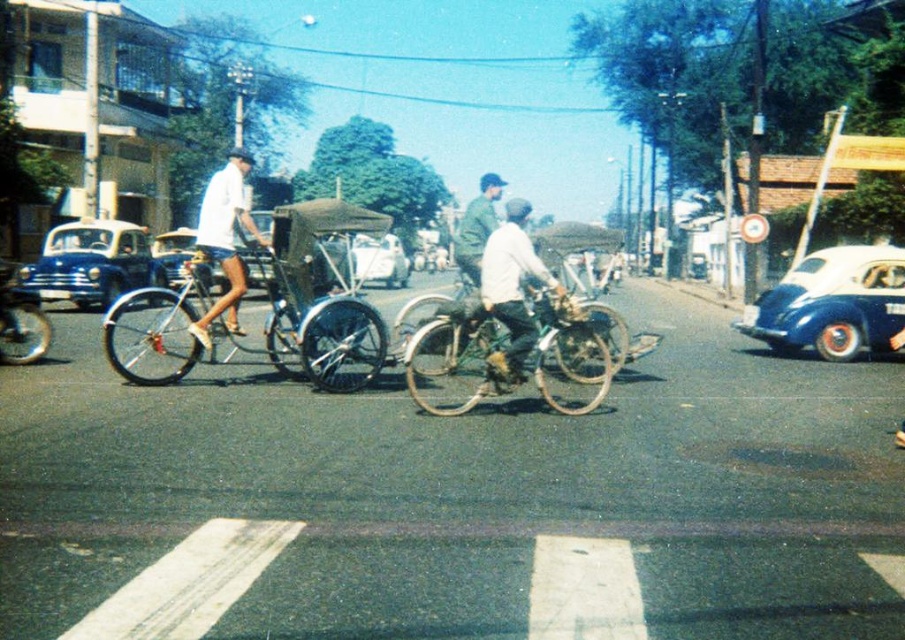
The width and height of the screenshot is (905, 640). Describe the element at coordinates (832, 304) in the screenshot. I see `blue matte car at right` at that location.

Between point (808, 333) and point (510, 326), which one is positioned behind?

The point (808, 333) is more distant.

Identify the location of blue matte car at right. (832, 304).

The image size is (905, 640). Describe the element at coordinates (511, 356) in the screenshot. I see `gold metallic bicycle at center` at that location.

Is gold metallic bicycle at center taller than blue matte car at right?

In fact, gold metallic bicycle at center may be shorter than blue matte car at right.

What do you see at coordinates (511, 356) in the screenshot? The image size is (905, 640). I see `gold metallic bicycle at center` at bounding box center [511, 356].

Identify the location of gold metallic bicycle at center. (511, 356).

Who is more forward, (82, 221) or (237, 173)?

Point (237, 173)

Which is in front, point (88, 298) or point (230, 272)?

Positioned in front is point (230, 272).

Locate an element on the screen. Image resolution: width=905 pixels, height=640 pixels. blue matte car at left is located at coordinates (92, 262).